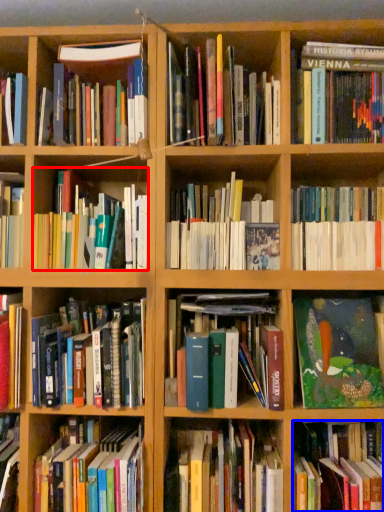
Question: Which object appears closest to the camera in this image, book (highlighted by a red box) or book (highlighted by a blue box)?

Choices:
 (A) book
 (B) book

Answer: (B)